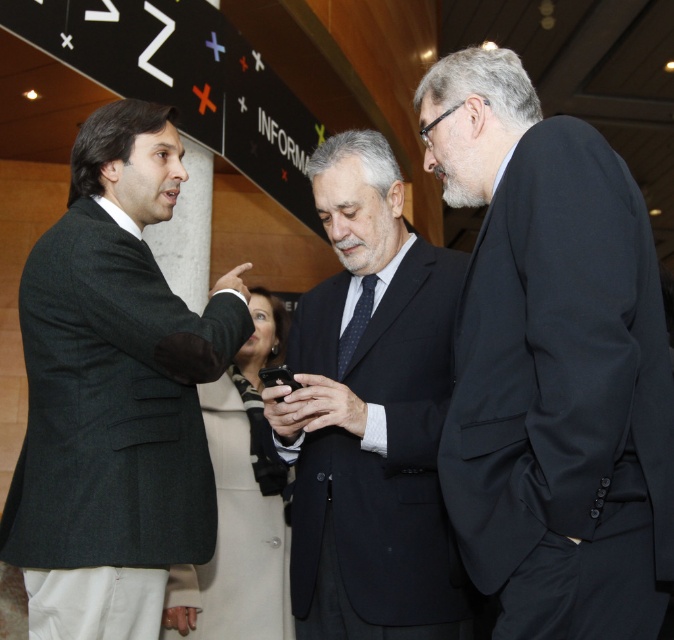
Question: Which point is closer to the camera?

Choices:
 (A) pos(613,541)
 (B) pos(404,570)

Answer: (A)

Question: Can you confirm if smooth black suit at center is wider than black matte phone at center?

Choices:
 (A) yes
 (B) no

Answer: (A)

Question: Estimate the real-world distances between objects in this image. Which object is farther from the dark gray wool suit at left?

Choices:
 (A) dark blue suit at center
 (B) black matte suit at right
 (C) smooth black suit at center
 (D) black matte phone at center

Answer: (B)

Question: Which of the following is the closest to the observer?

Choices:
 (A) [78, 540]
 (B) [330, 424]

Answer: (A)

Question: Can you confirm if dark blue suit at center is smaller than smooth black suit at center?

Choices:
 (A) yes
 (B) no

Answer: (B)

Question: Does dark gray wool suit at left have a lesser width compared to black matte phone at center?

Choices:
 (A) yes
 (B) no

Answer: (B)